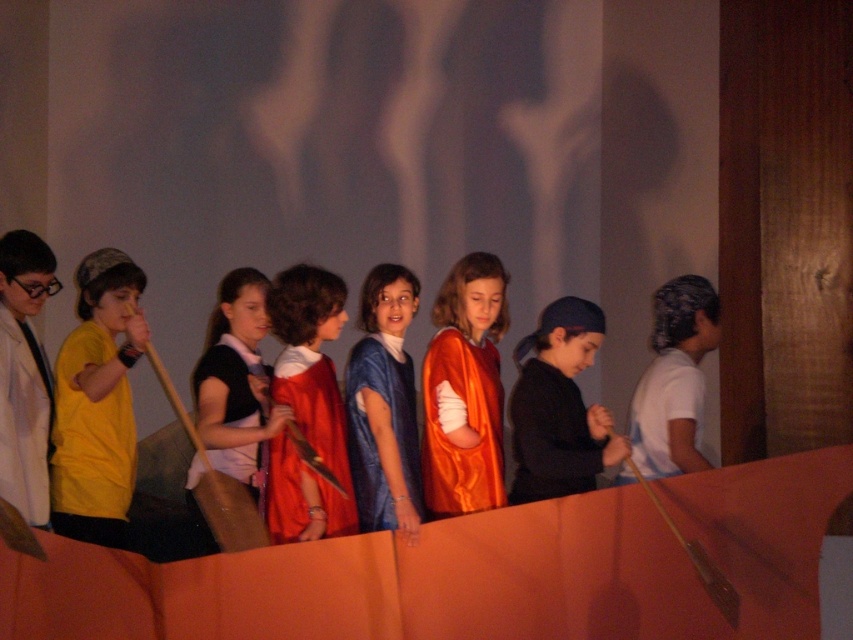
In the scene shown: You are a photographer standing at the point marked as point (x=421, y=490). You need to capture a photo of the children in the line. Considering the distance between you and the children, will you be able to clearly see all the children in the photo?

The distance between you and the children is 3.69 meters. At this distance, it is possible to clearly see all the children in the photo, provided the camera has a sufficient zoom or wide angle lens to capture the entire line without distortion.

You are a photographer trying to capture a group photo of the children in the scene. The two main subjects are the satin orange robe at center and the blue satin dress at center. Since you want both to be clearly visible in the photo, which one should you focus on first to ensure proper focus, considering their sizes?

The satin orange robe at center is smaller than the blue satin dress at center, so you should focus on the blue satin dress at center first since it is larger and will require more attention to capture details properly.